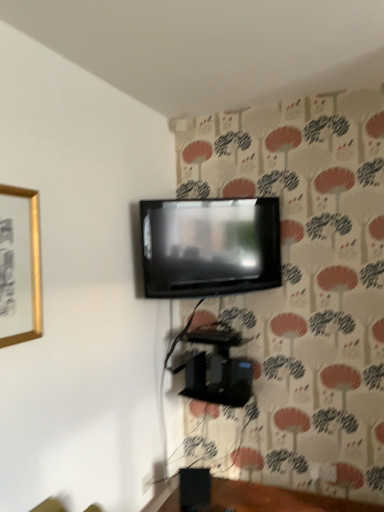
Identify the location of free space below matte black tv at upper center (from a real-world perspective). The image size is (384, 512). (255, 488).